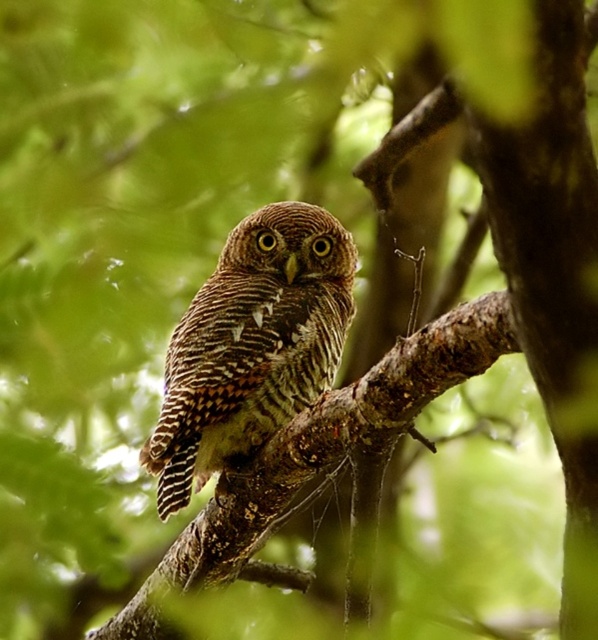
Question: Which point is farther to the camera?

Choices:
 (A) (182, 388)
 (B) (141, 592)

Answer: (B)

Question: Can you confirm if brown speckled owl at center is positioned above brown rough tree branch at center?

Choices:
 (A) no
 (B) yes

Answer: (B)

Question: Is brown speckled owl at center above brown rough tree branch at center?

Choices:
 (A) no
 (B) yes

Answer: (B)

Question: Is brown speckled owl at center smaller than brown rough tree branch at center?

Choices:
 (A) yes
 (B) no

Answer: (A)

Question: Among these objects, which one is nearest to the camera?

Choices:
 (A) brown rough tree branch at center
 (B) brown speckled owl at center

Answer: (A)

Question: Which of the following is the farthest from the observer?

Choices:
 (A) (487, 300)
 (B) (202, 429)

Answer: (B)